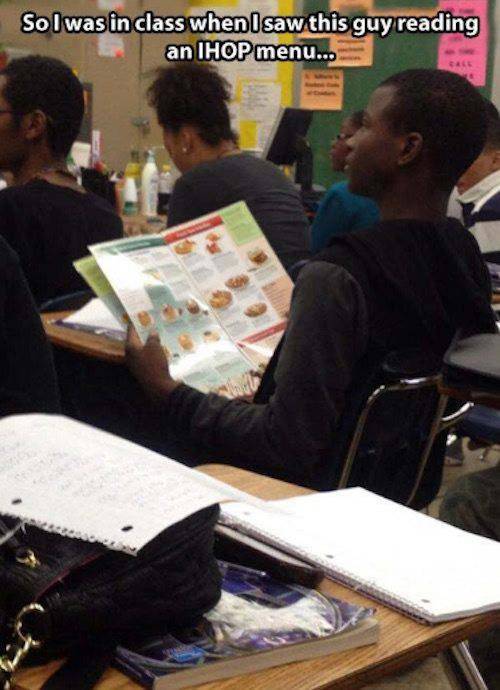
You are a GUI agent. You are given a task and a screenshot of the screen. Output one action in this format:
    pyautogui.click(x=<x>, y=<y>)
    Task: Click on the text book
    The image size is (500, 690).
    Given the screenshot: What is the action you would take?
    pyautogui.click(x=287, y=624)